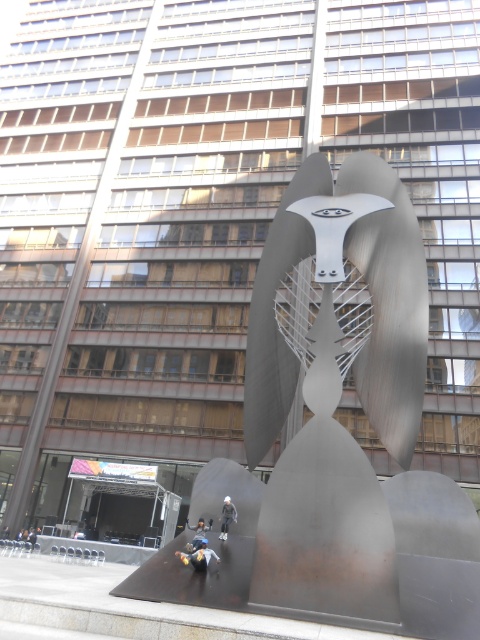
Question: Can you confirm if blue denim jeans at lower center is positioned below blue fabric at center?

Choices:
 (A) no
 (B) yes

Answer: (A)

Question: Does blue denim jeans at lower center have a larger size compared to white matte figure at center?

Choices:
 (A) yes
 (B) no

Answer: (B)

Question: Which point appears farthest from the camera in this image?

Choices:
 (A) (210, 556)
 (B) (348, 163)
 (C) (201, 541)
 (D) (225, 508)

Answer: (B)

Question: Which point is closer to the camera?

Choices:
 (A) (201, 525)
 (B) (216, 556)

Answer: (B)

Question: Which point appears farthest from the camera in this image?

Choices:
 (A) (230, 502)
 (B) (324, 305)
 (C) (196, 545)

Answer: (A)

Question: Is white matte figure at center smaller than blue fabric at center?

Choices:
 (A) yes
 (B) no

Answer: (A)